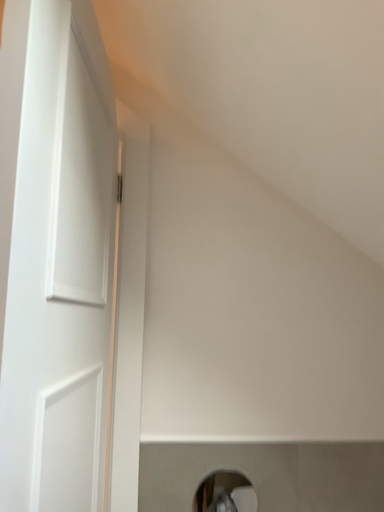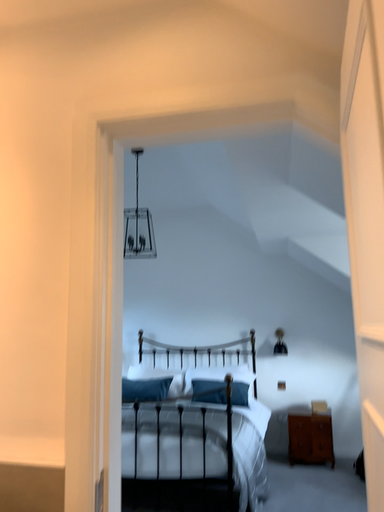
Question: Which way did the camera rotate in the video?

Choices:
 (A) rotated left
 (B) rotated right

Answer: (A)